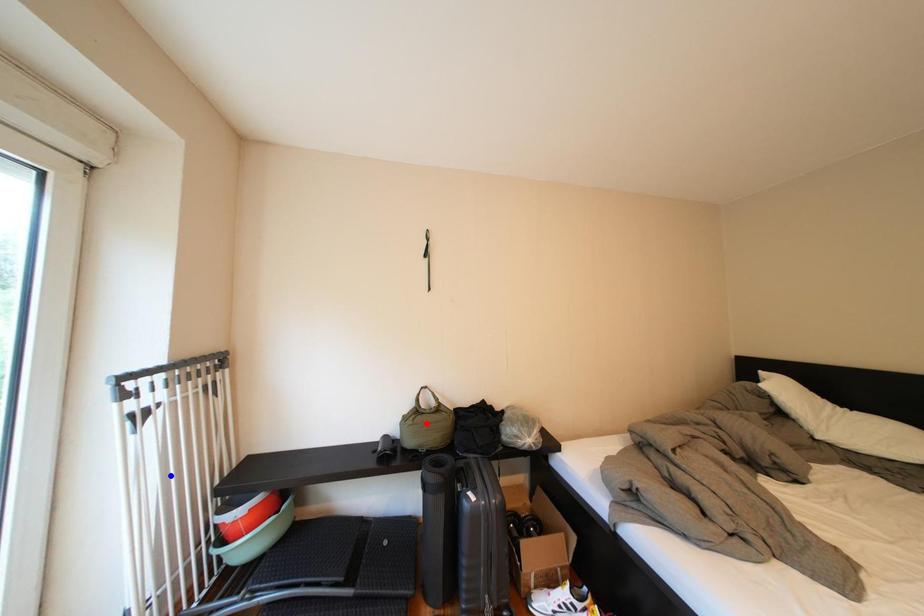
Question: In the image, two points are highlighted. Which point is nearer to the camera? Reply with the corresponding letter.

Choices:
 (A) blue point
 (B) red point

Answer: (A)